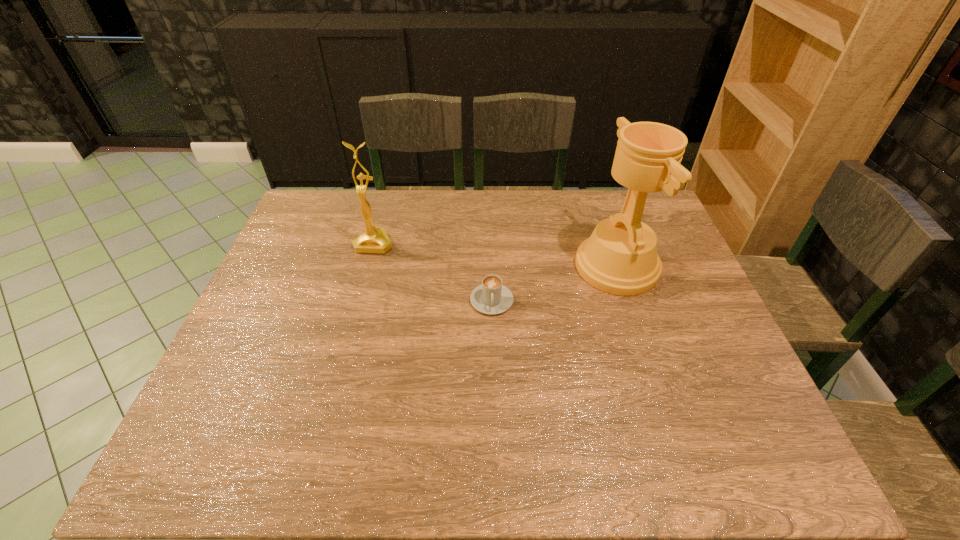
Locate an element on the screen. The width and height of the screenshot is (960, 540). vacant space that's between the cappuccino and the shorter award is located at coordinates (433, 272).

Locate an element on the screen. free space between the cappuccino and the tallest object is located at coordinates (554, 284).

The height and width of the screenshot is (540, 960). I want to click on vacant space in between the leftmost object and the second object from right to left, so click(x=433, y=272).

The width and height of the screenshot is (960, 540). Find the location of `vacant area between the second object from right to left and the left award`. vacant area between the second object from right to left and the left award is located at coordinates (433, 272).

I want to click on free space between the tallest object and the leftmost object, so click(495, 255).

Image resolution: width=960 pixels, height=540 pixels. What are the coordinates of `object that stands as the closest to the second object from left to right` in the screenshot? It's located at (620, 257).

Locate which object ranks in proximity to the rightmost object. Please provide its 2D coordinates. Your answer should be formatted as a tuple, i.e. [(x, y)], where the tuple contains the x and y coordinates of a point satisfying the conditions above.

[(491, 297)]

Image resolution: width=960 pixels, height=540 pixels. Identify the location of free location that satisfies the following two spatial constraints: 1. on the front-facing side of the tallest object; 2. on the left side of the left award. tap(368, 266).

Where is `free spot that satisfies the following two spatial constraints: 1. on the front-facing side of the left award; 2. on the right side of the right award`? free spot that satisfies the following two spatial constraints: 1. on the front-facing side of the left award; 2. on the right side of the right award is located at coordinates (368, 266).

Identify the location of free space that satisfies the following two spatial constraints: 1. on the front-facing side of the rightmost object; 2. on the left side of the leftmost object. This screenshot has width=960, height=540. (368, 266).